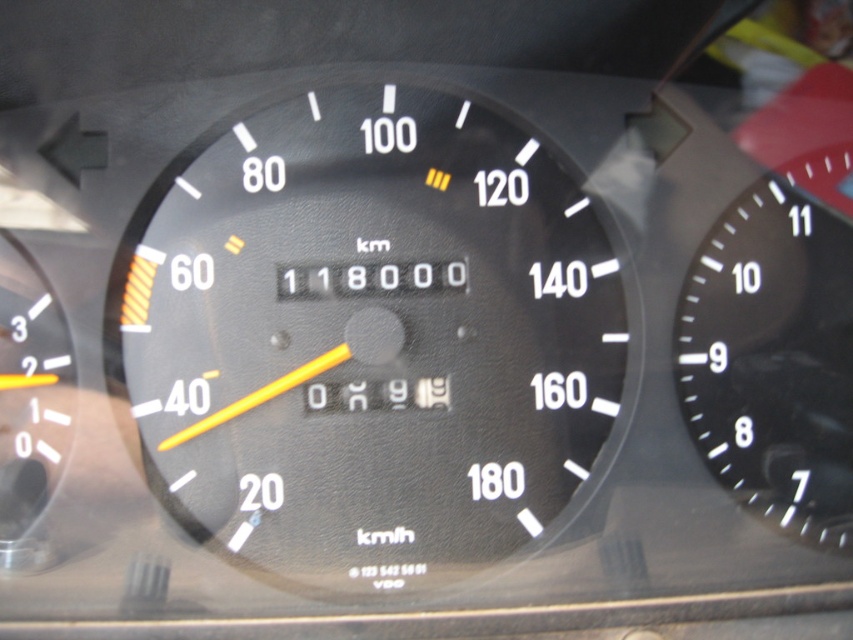
You are a driver checking your vehicle instruments. You see the point at coordinates (367, 333). What does this point correspond to?

The point at coordinates (367, 333) corresponds to the black matte speedometer at center.

You are driving a car and want to check both the black matte speedometer at center and the black matte speedometer at right. Which one is located to the left of the other?

The black matte speedometer at center is positioned on the left side of the black matte speedometer at right.